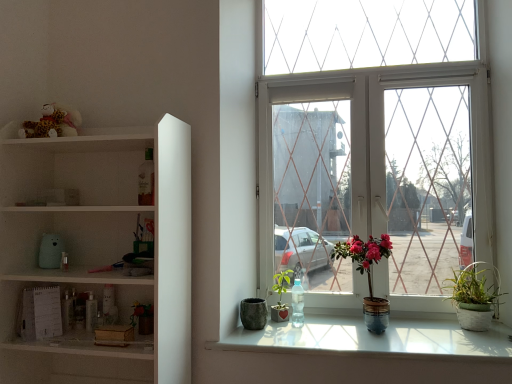
Question: Does green matte plant at lower left, placed as the fourth houseplant when sorted from right to left, turn towards matte gray stone pot at lower center?

Choices:
 (A) yes
 (B) no

Answer: (B)

Question: Would you say green matte plant at lower left, the 1th houseplant positioned from the left, is outside matte gray stone pot at lower center?

Choices:
 (A) yes
 (B) no

Answer: (A)

Question: Can matte gray stone pot at lower center be found inside green matte plant at lower left, the 1th houseplant positioned from the left?

Choices:
 (A) no
 (B) yes

Answer: (A)

Question: Would you consider green matte plant at lower left, the 1th houseplant positioned from the left, to be distant from matte gray stone pot at lower center?

Choices:
 (A) yes
 (B) no

Answer: (B)

Question: Does green matte plant at lower left, the 1th houseplant positioned from the left, have a lesser height compared to matte gray stone pot at lower center?

Choices:
 (A) no
 (B) yes

Answer: (A)

Question: From the image's perspective, is matte ceramic pot at center, the 2th houseplant when ordered from right to left, located above or below white matte shelf at left?

Choices:
 (A) below
 (B) above

Answer: (A)

Question: From a real-world perspective, relative to white matte shelf at left, is matte ceramic pot at center, the 2th houseplant when ordered from right to left, vertically above or below?

Choices:
 (A) above
 (B) below

Answer: (B)

Question: Is matte ceramic pot at center, which appears as the 3th houseplant when viewed from the left, taller or shorter than white matte shelf at left?

Choices:
 (A) tall
 (B) short

Answer: (B)

Question: Is point click(x=357, y=269) closer or farther from the camera than point click(x=39, y=152)?

Choices:
 (A) farther
 (B) closer

Answer: (A)

Question: Considering the positions of matte ceramic pot at center, the 2th houseplant when ordered from right to left, and white woven basket at lower right, which is the 4th houseplant from left to right, in the image, is matte ceramic pot at center, the 2th houseplant when ordered from right to left, wider or thinner than white woven basket at lower right, which is the 4th houseplant from left to right,?

Choices:
 (A) wide
 (B) thin

Answer: (A)

Question: From the image's perspective, is matte ceramic pot at center, which appears as the 3th houseplant when viewed from the left, located above or below white woven basket at lower right, which is the 4th houseplant from left to right?

Choices:
 (A) above
 (B) below

Answer: (A)

Question: In terms of size, does matte ceramic pot at center, the 2th houseplant when ordered from right to left, appear bigger or smaller than white woven basket at lower right, which is the 4th houseplant from left to right?

Choices:
 (A) small
 (B) big

Answer: (B)

Question: From their relative heights in the image, would you say matte ceramic pot at center, which appears as the 3th houseplant when viewed from the left, is taller or shorter than white woven basket at lower right, placed as the first houseplant when sorted from right to left?

Choices:
 (A) short
 (B) tall

Answer: (B)

Question: Is transparent plastic bottle at window inside or outside of white woven basket at lower right, which is the 4th houseplant from left to right?

Choices:
 (A) inside
 (B) outside

Answer: (B)

Question: Is transparent plastic bottle at window wider or thinner than white woven basket at lower right, which is the 4th houseplant from left to right?

Choices:
 (A) thin
 (B) wide

Answer: (A)